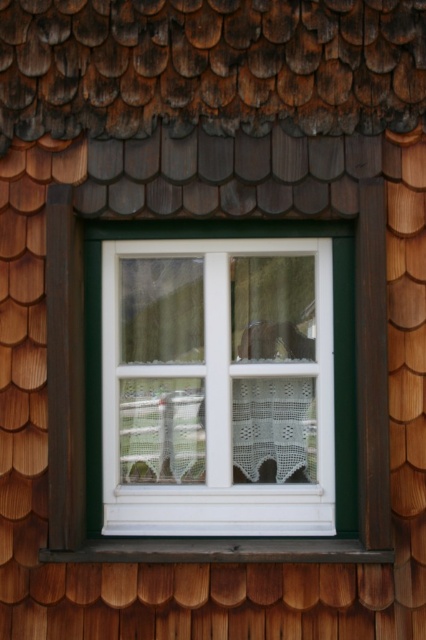
Question: Which of the following is the closest to the observer?

Choices:
 (A) white plastic window at center
 (B) dark wood at bottom

Answer: (B)

Question: Which point is farther to the camera?

Choices:
 (A) white plastic window at center
 (B) dark wood at bottom

Answer: (A)

Question: Does white plastic window at center come behind dark wood at bottom?

Choices:
 (A) no
 (B) yes

Answer: (B)

Question: Is white plastic window at center bigger than dark wood at bottom?

Choices:
 (A) no
 (B) yes

Answer: (B)

Question: Is white plastic window at center wider than dark wood at bottom?

Choices:
 (A) no
 (B) yes

Answer: (A)

Question: Which point is farther to the camera?

Choices:
 (A) (233, 554)
 (B) (307, 305)

Answer: (B)